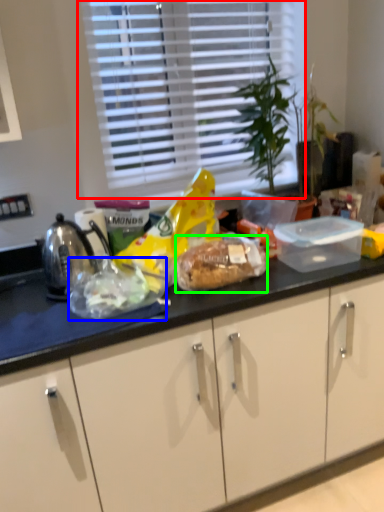
Question: Based on their relative distances, which object is farther from window (highlighted by a red box)? Choose from food (highlighted by a blue box) and snack (highlighted by a green box).

Choices:
 (A) food
 (B) snack

Answer: (A)